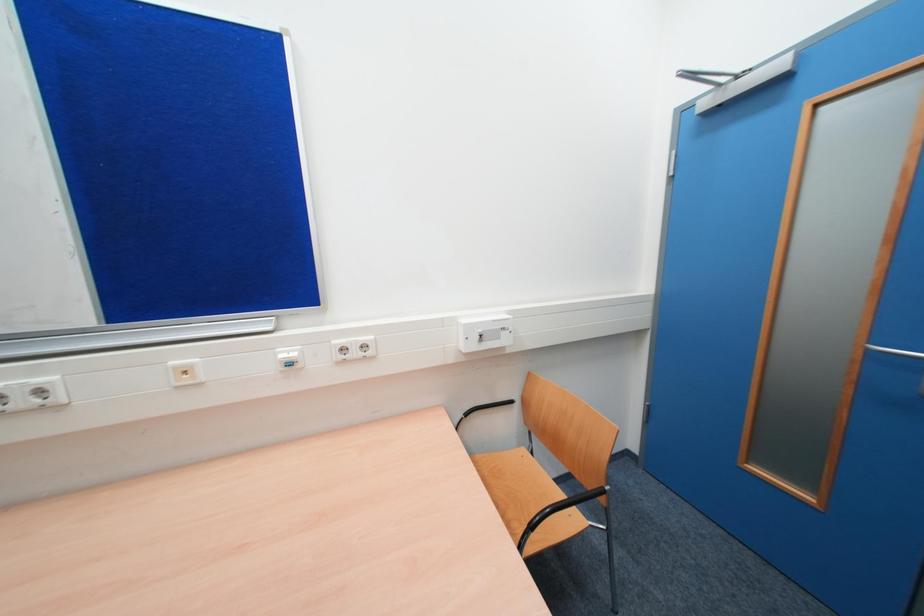
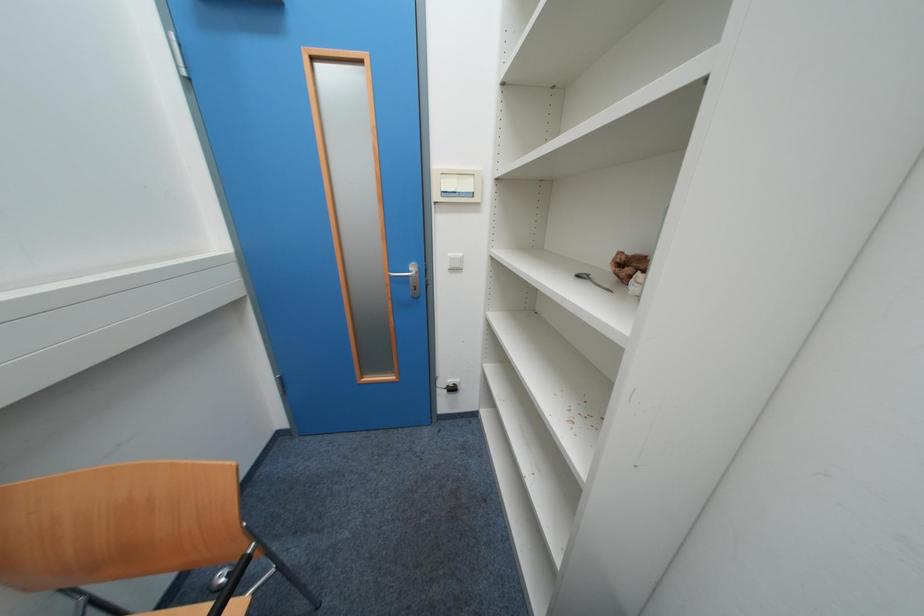
How did the camera likely rotate?

The camera's rotation is toward right-down.